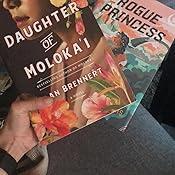
At what (x,y) coordinates should I click in order to perform the action: click on grey cushion. Please return your answer as a coordinate pair (x, y). The image size is (175, 175). Looking at the image, I should click on point(122,150).